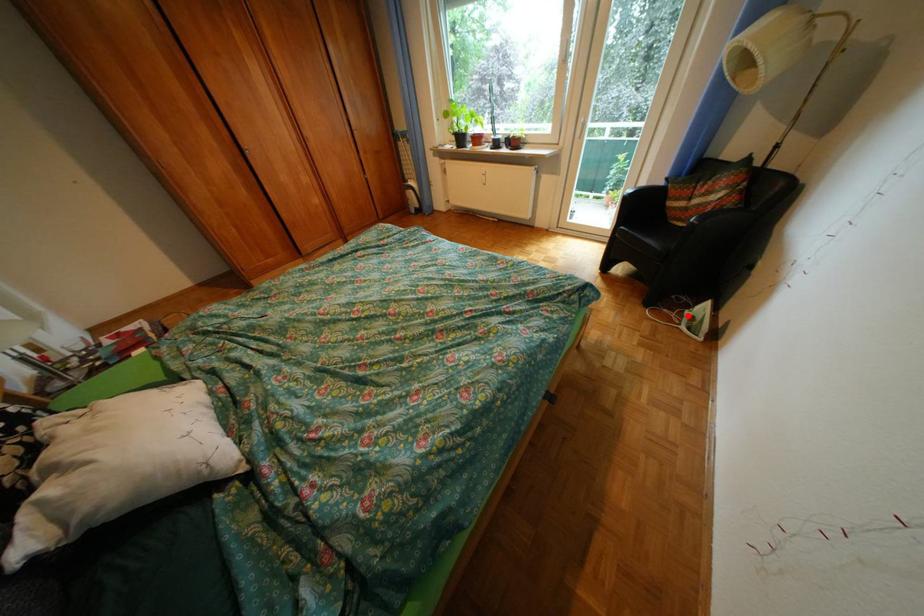
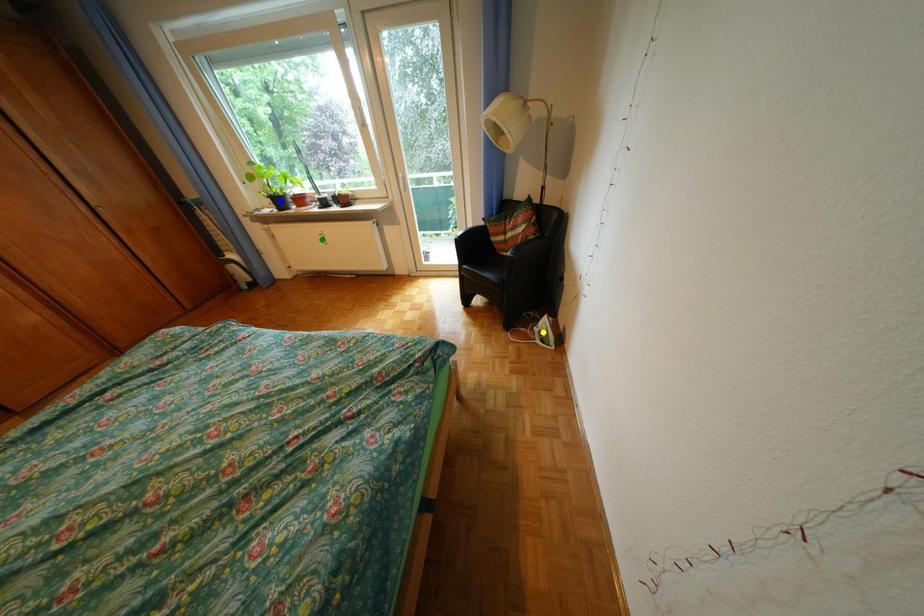
Question: I am providing you with two images of the same scene from different viewpoints. A red point is marked on the first image. You are given multiple points on the second image. Which point in image 2 is actually the same real-world point as the red point in image 1?

Choices:
 (A) blue point
 (B) green point
 (C) yellow point

Answer: (C)